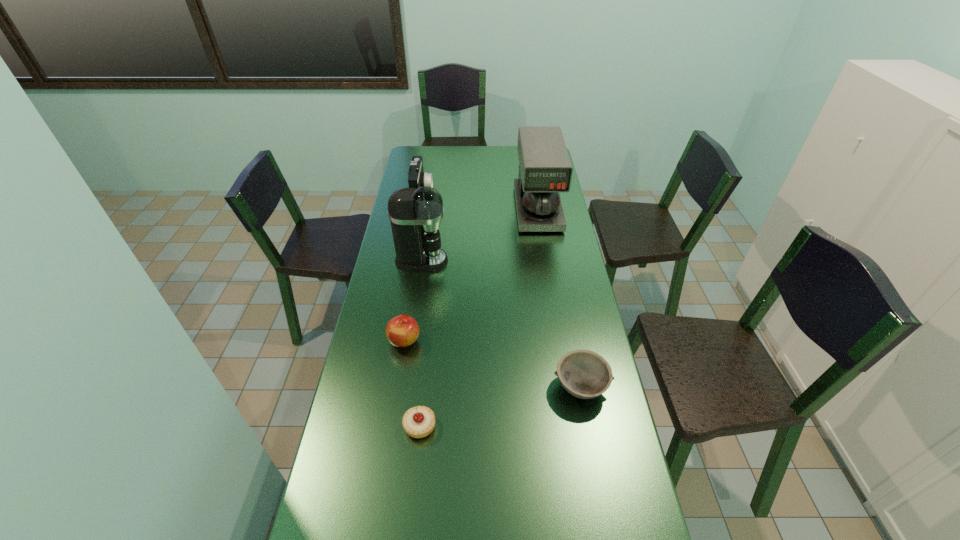
Identify the location of free spot located 0.160m place cup under the spout of the left coffee maker. (490, 261).

This screenshot has height=540, width=960. Find the location of `vacant space located 0.340m on the carafe side of the right coffee maker`. vacant space located 0.340m on the carafe side of the right coffee maker is located at coordinates pos(551,292).

The width and height of the screenshot is (960, 540). I want to click on free space located 0.160m on the lens of the third tallest object, so click(467, 192).

This screenshot has height=540, width=960. In order to click on vacant space located 0.150m on the front of the third nearest object in this screenshot , I will do `click(396, 395)`.

Where is `blank area located on the left of the bowl`? blank area located on the left of the bowl is located at coordinates (441, 387).

The width and height of the screenshot is (960, 540). Identify the location of free region located on the right of the nearest object. (494, 427).

Identify the location of coffee maker present at the left edge. The height and width of the screenshot is (540, 960). (415, 214).

Locate an element on the screen. The height and width of the screenshot is (540, 960). camcorder that is at the left edge is located at coordinates (417, 178).

Identify the location of apple at the left edge. This screenshot has width=960, height=540. (402, 331).

The image size is (960, 540). Identify the location of coffee maker present at the right edge. (545, 169).